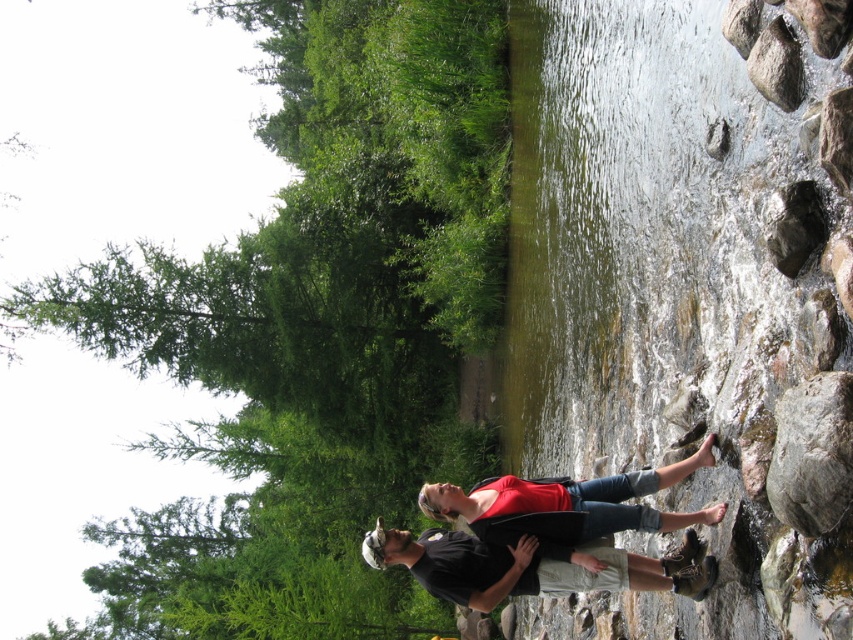
Question: Considering the relative positions of black matte shirt at center and red matte shirt at center in the image provided, where is black matte shirt at center located with respect to red matte shirt at center?

Choices:
 (A) left
 (B) right

Answer: (A)

Question: Which point is farther to the camera?

Choices:
 (A) (535, 556)
 (B) (561, 484)

Answer: (B)

Question: Is black matte shirt at center above red matte shirt at center?

Choices:
 (A) no
 (B) yes

Answer: (A)

Question: Can you confirm if black matte shirt at center is thinner than red matte shirt at center?

Choices:
 (A) no
 (B) yes

Answer: (A)